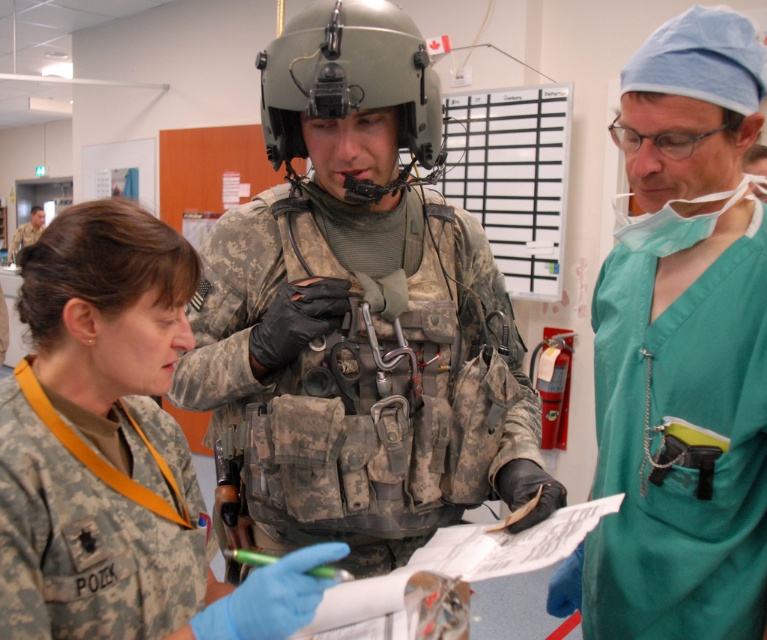
Describe the element at coordinates (680, 352) in the screenshot. I see `green scrubs at right` at that location.

Does point (731, 90) lie in front of point (25, 621)?

No.

This screenshot has width=767, height=640. Identify the location of green scrubs at right. (680, 352).

Is camouflage uniform at center closer to camera compared to matte gray helmet at center?

Yes, it is in front of matte gray helmet at center.

Between camouflage uniform at center and matte gray helmet at center, which one is positioned lower?

camouflage uniform at center is lower down.

Between point (120, 259) and point (430, 136), which one is positioned behind?

The point (430, 136) is more distant.

The image size is (767, 640). I want to click on camouflage uniform at center, so click(x=114, y=451).

Does green scrubs at right appear on the left side of matte gray helmet at center?

In fact, green scrubs at right is to the right of matte gray helmet at center.

Is green scrubs at right wider than matte gray helmet at center?

In fact, green scrubs at right might be narrower than matte gray helmet at center.

Locate an element on the screen. This screenshot has width=767, height=640. green scrubs at right is located at coordinates (680, 352).

This screenshot has width=767, height=640. I want to click on green scrubs at right, so click(x=680, y=352).